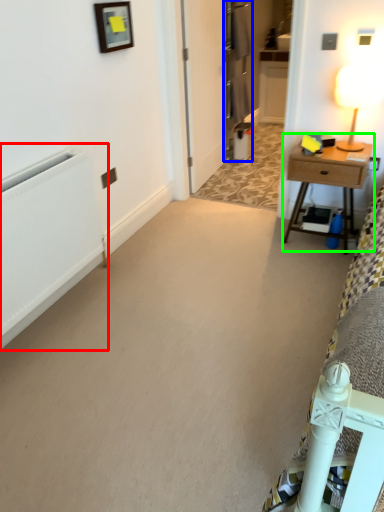
Question: Which object is positioned farthest from radiator (highlighted by a red box)? Select from armoire (highlighted by a blue box) and nightstand (highlighted by a green box).

Choices:
 (A) armoire
 (B) nightstand

Answer: (A)